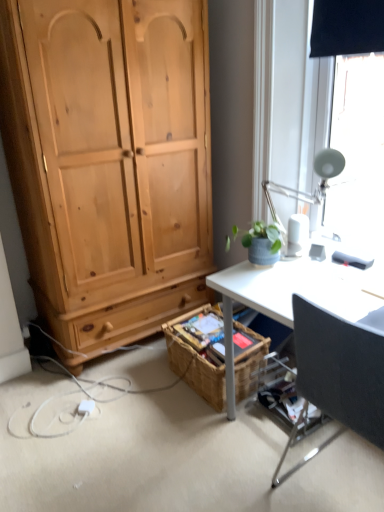
Question: Is woven brown picnic basket at lower center taller than black fabric chair at right?

Choices:
 (A) yes
 (B) no

Answer: (B)

Question: Does woven brown picnic basket at lower center appear on the right side of black fabric chair at right?

Choices:
 (A) yes
 (B) no

Answer: (B)

Question: From a real-world perspective, does woven brown picnic basket at lower center stand above black fabric chair at right?

Choices:
 (A) yes
 (B) no

Answer: (B)

Question: Is woven brown picnic basket at lower center positioned in front of black fabric chair at right?

Choices:
 (A) no
 (B) yes

Answer: (A)

Question: Is woven brown picnic basket at lower center thinner than black fabric chair at right?

Choices:
 (A) no
 (B) yes

Answer: (B)

Question: Would you say woven brown picnic basket at lower center is a long distance from black fabric chair at right?

Choices:
 (A) no
 (B) yes

Answer: (A)

Question: Is white metallic lamp at upper right at the back of black fabric chair at right?

Choices:
 (A) no
 (B) yes

Answer: (A)

Question: Is the position of black fabric chair at right more distant than that of white metallic lamp at upper right?

Choices:
 (A) no
 (B) yes

Answer: (A)

Question: Is black fabric chair at right closer to camera compared to white metallic lamp at upper right?

Choices:
 (A) yes
 (B) no

Answer: (A)

Question: Are black fabric chair at right and white metallic lamp at upper right making contact?

Choices:
 (A) yes
 (B) no

Answer: (B)

Question: Considering the relative sizes of black fabric chair at right and white metallic lamp at upper right in the image provided, is black fabric chair at right thinner than white metallic lamp at upper right?

Choices:
 (A) no
 (B) yes

Answer: (A)

Question: From a real-world perspective, is black fabric chair at right beneath white metallic lamp at upper right?

Choices:
 (A) yes
 (B) no

Answer: (A)

Question: Does black fabric chair at right turn towards woven brown picnic basket at lower center?

Choices:
 (A) no
 (B) yes

Answer: (A)